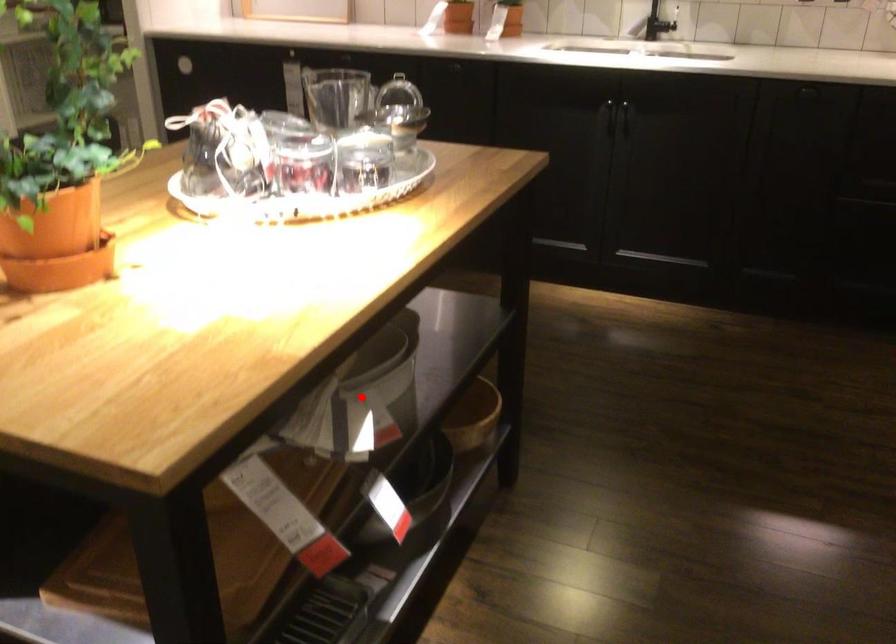
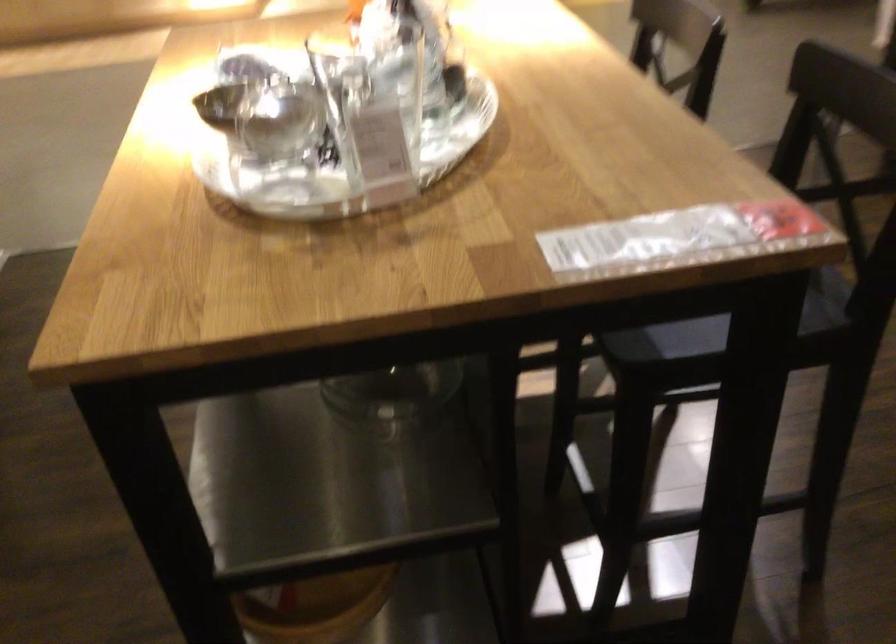
Question: I am providing you with two images of the same scene from different viewpoints. A red point is marked on the first image. Is the red point's position out of view in image 2?

Choices:
 (A) Yes
 (B) No

Answer: (A)